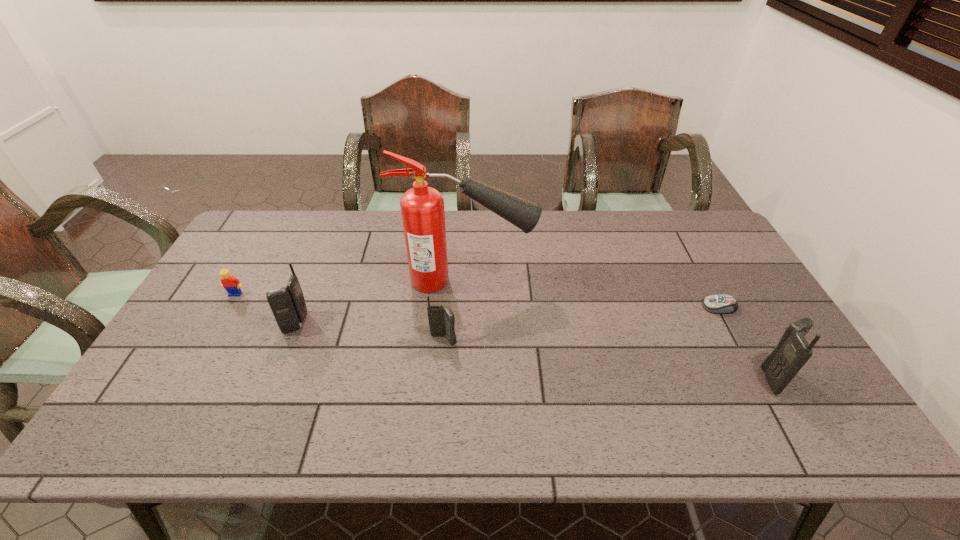
Locate an element on the screen. This screenshot has height=540, width=960. the fourth shortest object is located at coordinates (288, 306).

Locate an element on the screen. the leftmost cellular telephone is located at coordinates (288, 306).

Identify the location of the third shortest object. (441, 319).

The height and width of the screenshot is (540, 960). Identify the location of the shortest cellular telephone. (441, 319).

You are a GUI agent. You are given a task and a screenshot of the screen. Output one action in this format:
    pyautogui.click(x=<x>, y=<y>)
    Task: Click on the rightmost cellular telephone
    The height and width of the screenshot is (540, 960).
    Given the screenshot: What is the action you would take?
    tap(792, 352)

Where is `the nearest cellular telephone`? The height and width of the screenshot is (540, 960). the nearest cellular telephone is located at coordinates (792, 352).

The width and height of the screenshot is (960, 540). Identify the location of computer mouse. (719, 304).

You are a GUI agent. You are given a task and a screenshot of the screen. Output one action in this format:
    pyautogui.click(x=<x>, y=<y>)
    Task: Click on the tallest object
    Image resolution: width=960 pixels, height=540 pixels.
    Given the screenshot: What is the action you would take?
    pyautogui.click(x=422, y=207)

Image resolution: width=960 pixels, height=540 pixels. What are the coordinates of `the leftmost object` in the screenshot? It's located at (229, 282).

Where is `the second shortest object`? the second shortest object is located at coordinates (229, 282).